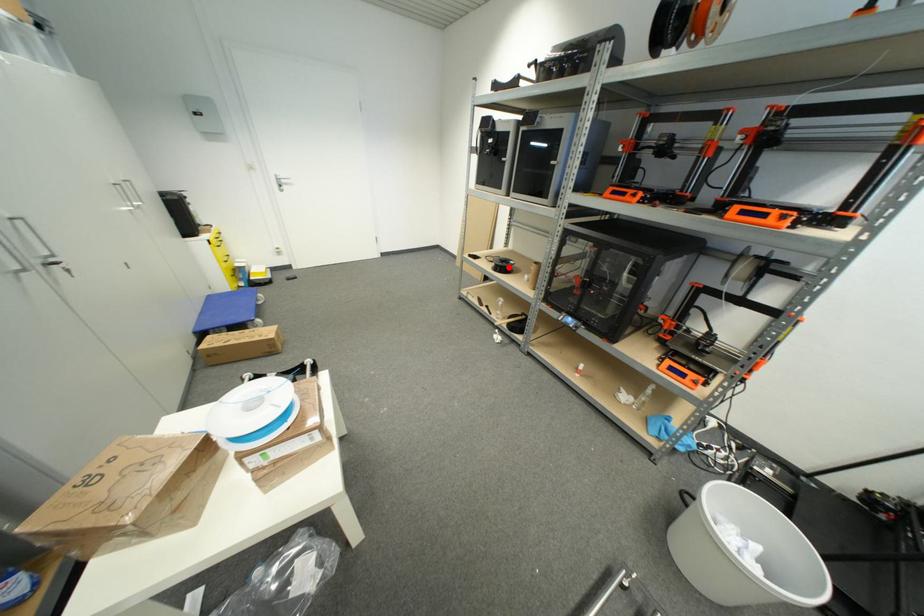
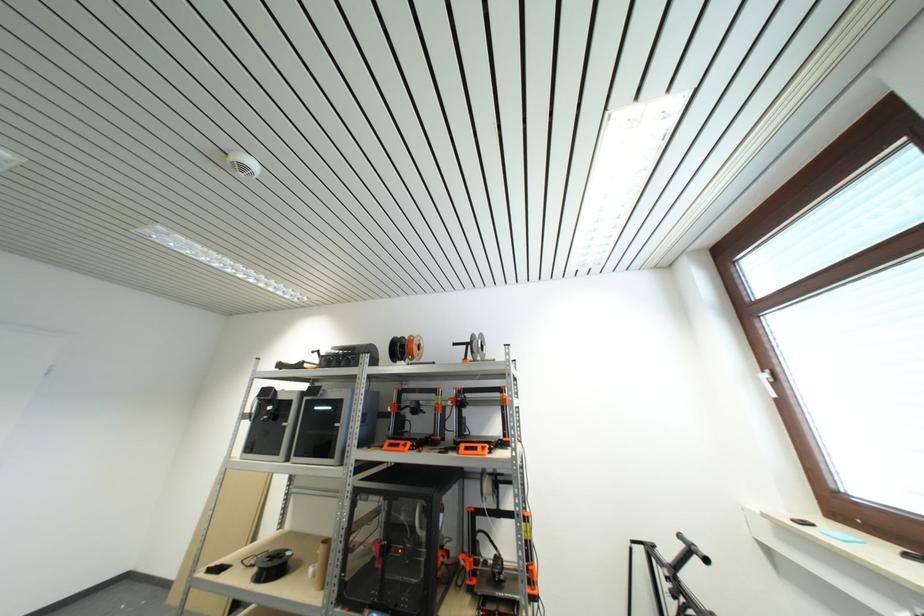
Question: I am providing you with two images of the same scene from different viewpoints. Image1 has a red point marked. In image2, the corresponding 3D location appears at what relative position? Reply with the corresponding letter.

Choices:
 (A) Closer
 (B) Farther

Answer: (B)